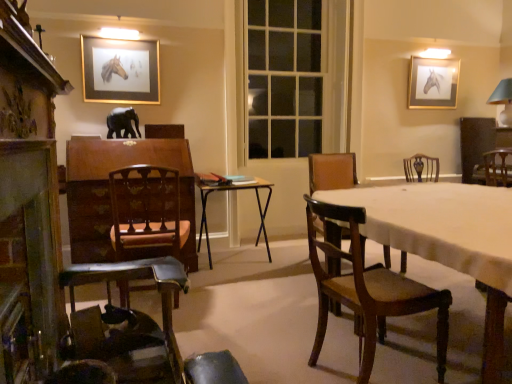
At what (x,y) coordinates should I click in order to perform the action: click on empty space that is ontop of gold-framed picture of horse at upper right, positioned as the 1th picture frame in right-to-left order (from a real-world perspective). Please return your answer as a coordinate pair (x, y). Image resolution: width=512 pixels, height=384 pixels. Looking at the image, I should click on (428, 58).